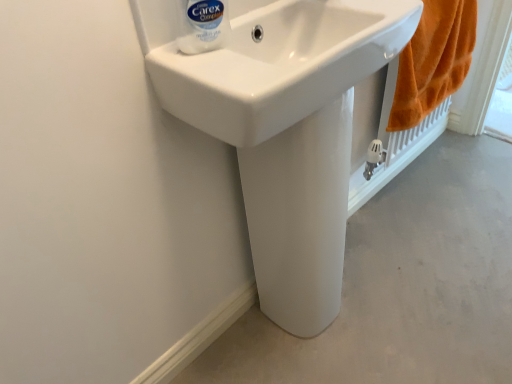
In order to click on free spot above white smooth pedestal at center (from a real-world perspective) in this screenshot , I will do `click(415, 268)`.